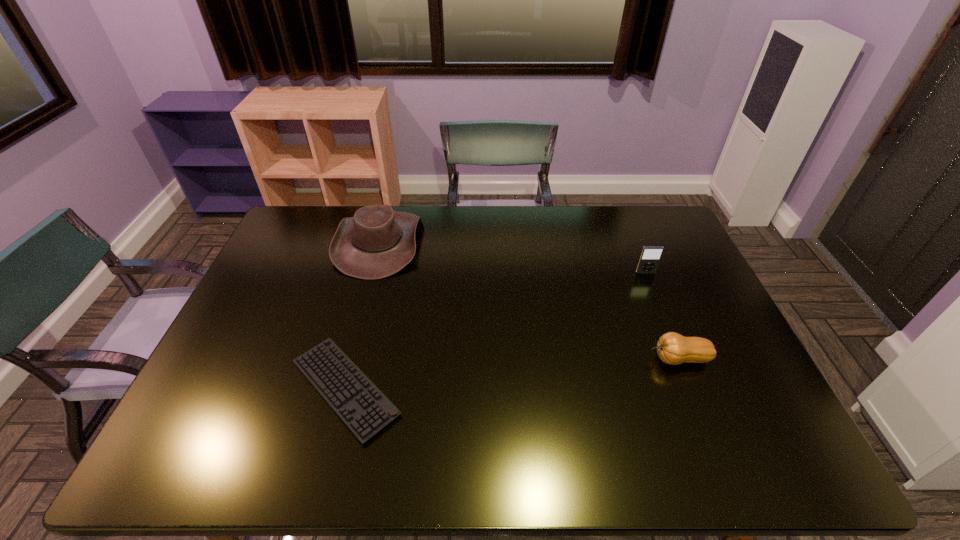
The width and height of the screenshot is (960, 540). I want to click on object present at the far edge, so click(x=377, y=242).

Image resolution: width=960 pixels, height=540 pixels. I want to click on object situated at the near edge, so pos(365,410).

The width and height of the screenshot is (960, 540). In order to click on iPod that is at the right edge in this screenshot , I will do point(650,256).

Identify the location of gourd that is at the right edge. This screenshot has height=540, width=960. (672, 348).

Image resolution: width=960 pixels, height=540 pixels. Identify the location of blank space at the far edge of the desktop. (565, 209).

Identify the location of vacant area at the near edge of the desktop. (292, 454).

Where is `vacant area at the left edge`? The image size is (960, 540). vacant area at the left edge is located at coordinates tap(280, 300).

Where is `vacant area at the right edge`? The width and height of the screenshot is (960, 540). vacant area at the right edge is located at coordinates (691, 375).

In the image, there is a desktop. Where is `vacant space at the far left corner`? This screenshot has width=960, height=540. vacant space at the far left corner is located at coordinates click(284, 235).

You are a GUI agent. You are given a task and a screenshot of the screen. Output one action in this format:
    pyautogui.click(x=<x>, y=<y>)
    Task: Click on the vacant space at the far right corner of the desktop
    
    Given the screenshot: What is the action you would take?
    pyautogui.click(x=647, y=237)